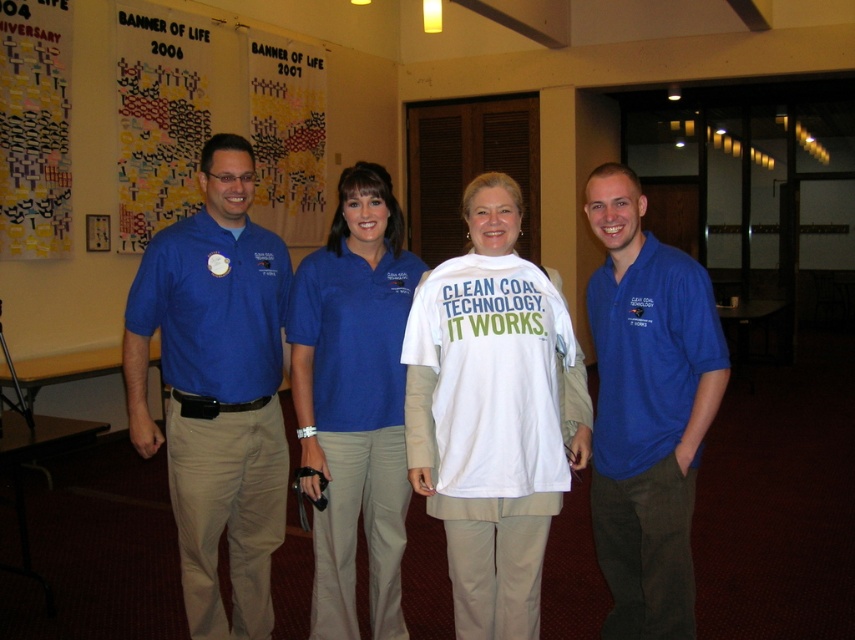
Question: Which object is positioned farthest from the matte blue polo shirt at right?

Choices:
 (A) white cotton shirt at center
 (B) matte blue polo shirt at left
 (C) matte blue polo shirt at center

Answer: (B)

Question: Which of the following is the farthest from the observer?

Choices:
 (A) (431, 417)
 (B) (662, 612)

Answer: (A)

Question: Which point appears closest to the camera in this image?

Choices:
 (A) (192, 500)
 (B) (428, 324)
 (C) (381, 285)
 (D) (653, 614)

Answer: (D)

Question: Does matte blue polo shirt at left have a greater width compared to matte blue polo shirt at center?

Choices:
 (A) no
 (B) yes

Answer: (B)

Question: Does matte blue polo shirt at left have a lesser width compared to matte blue polo shirt at right?

Choices:
 (A) yes
 (B) no

Answer: (B)

Question: Is matte blue polo shirt at left behind matte blue polo shirt at right?

Choices:
 (A) yes
 (B) no

Answer: (A)